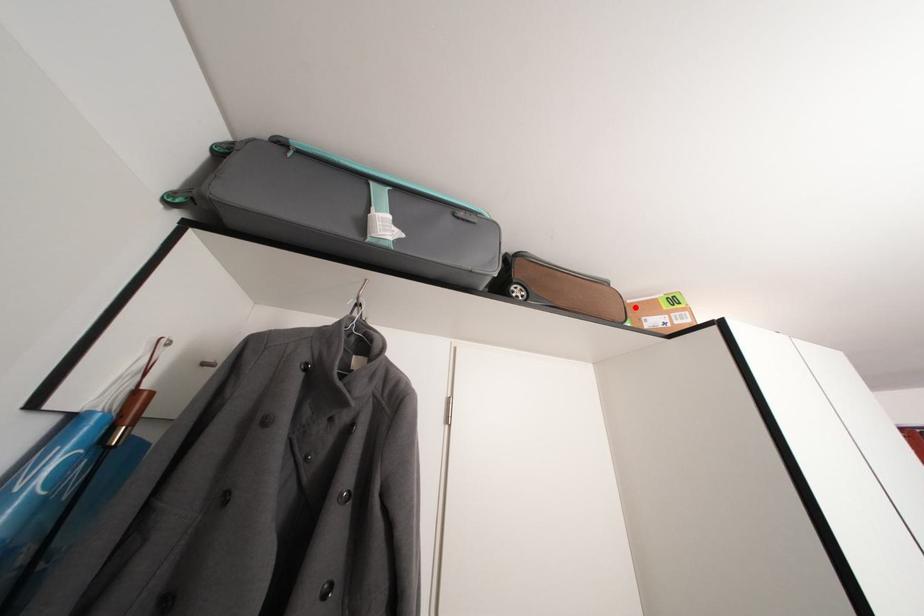
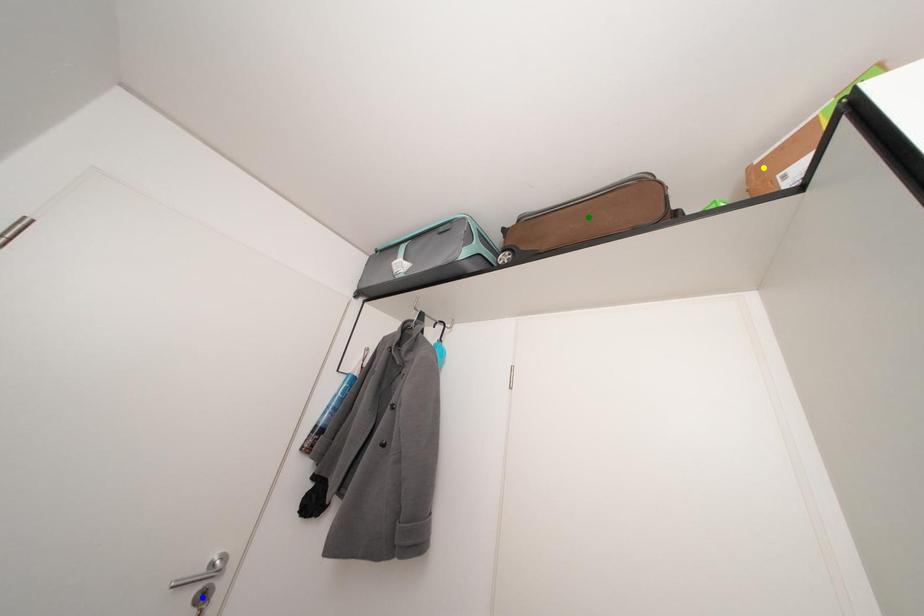
Question: I am providing you with two images of the same scene from different viewpoints. A red point is marked on the first image. You are given multiple points on the second image. Which spot in image 2 lines up with the point in image 1?

Choices:
 (A) green point
 (B) blue point
 (C) yellow point

Answer: (C)